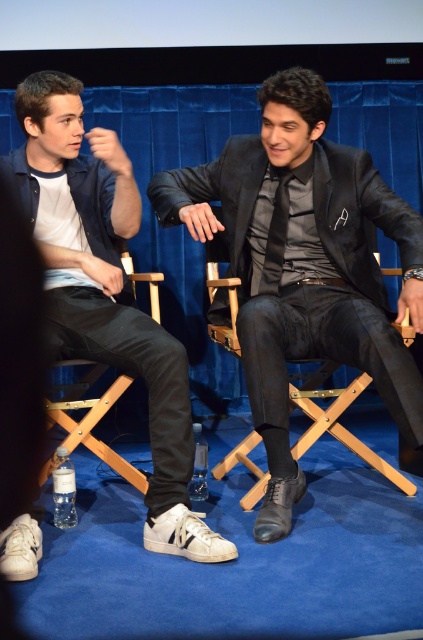
You are standing at point (222, 308) and want to take a photo of the scene. The camera is 9.15 feet away from you. Is the camera within the 10 feet range required for clear focus?

The camera is 9.15 feet away from point (222, 308), so yes, it is within the 10 feet range required for clear focus.

In the scene shown: You are a photographer at the event and need to adjust the lighting so that the black leather shoes at center and the wooden folding chair at lower left are both well lit. Based on their positions, which object is closer to the right side of the frame?

The black leather shoes at center is positioned on the right side of wooden folding chair at lower left, so the black leather shoes at center is closer to the right side of the frame.

You are organizing a charity event and need to arrange items on a shelf. The shelf has limited space. You have the white leather sneakers at lower left and the silky black tie at center. Which item requires more horizontal space on the shelf?

The white leather sneakers at lower left require more horizontal space on the shelf because their width surpasses that of the silky black tie at center.